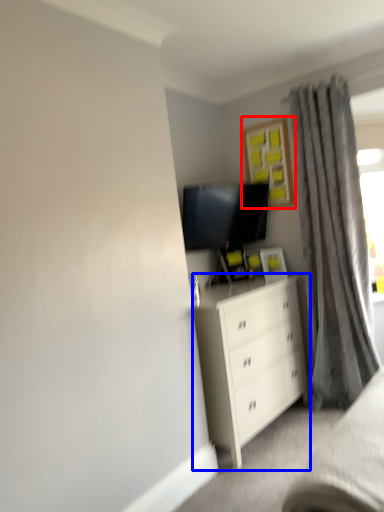
Question: Among these objects, which one is nearest to the camera, picture frame (highlighted by a red box) or chest of drawers (highlighted by a blue box)?

Choices:
 (A) picture frame
 (B) chest of drawers

Answer: (B)